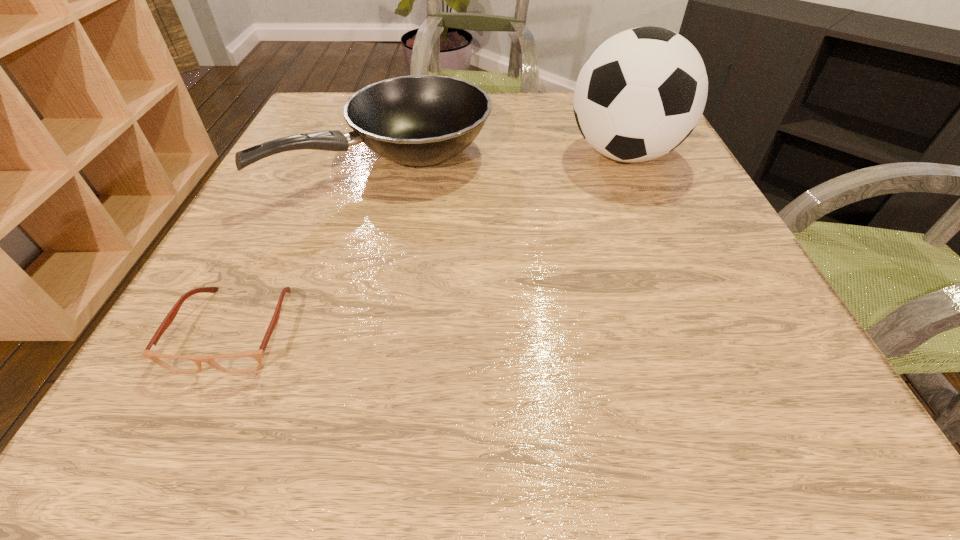
Locate an element on the screen. This screenshot has width=960, height=540. vacant area between the frying pan and the rightmost object is located at coordinates (505, 157).

This screenshot has height=540, width=960. I want to click on vacant space in between the rightmost object and the spectacles, so click(x=429, y=242).

Locate an element on the screen. vacant space that is in between the frying pan and the spectacles is located at coordinates (311, 245).

Find the location of a particular element. The width and height of the screenshot is (960, 540). free point between the spectacles and the soccer ball is located at coordinates (429, 242).

This screenshot has width=960, height=540. What are the coordinates of `vacant point located between the rightmost object and the second shortest object` in the screenshot? It's located at (505, 157).

This screenshot has height=540, width=960. I want to click on vacant area that lies between the frying pan and the soccer ball, so click(x=505, y=157).

At what (x,y) coordinates should I click in order to perform the action: click on free space between the nearest object and the soccer ball. Please return your answer as a coordinate pair (x, y). The image size is (960, 540). Looking at the image, I should click on (429, 242).

Where is `empty space that is in between the shortest object and the frying pan`? The image size is (960, 540). empty space that is in between the shortest object and the frying pan is located at coordinates (311, 245).

Where is `vacant region between the second tallest object and the rightmost object`? vacant region between the second tallest object and the rightmost object is located at coordinates tap(505, 157).

At what (x,y) coordinates should I click in order to perform the action: click on unoccupied position between the nearest object and the soccer ball. Please return your answer as a coordinate pair (x, y). Looking at the image, I should click on (429, 242).